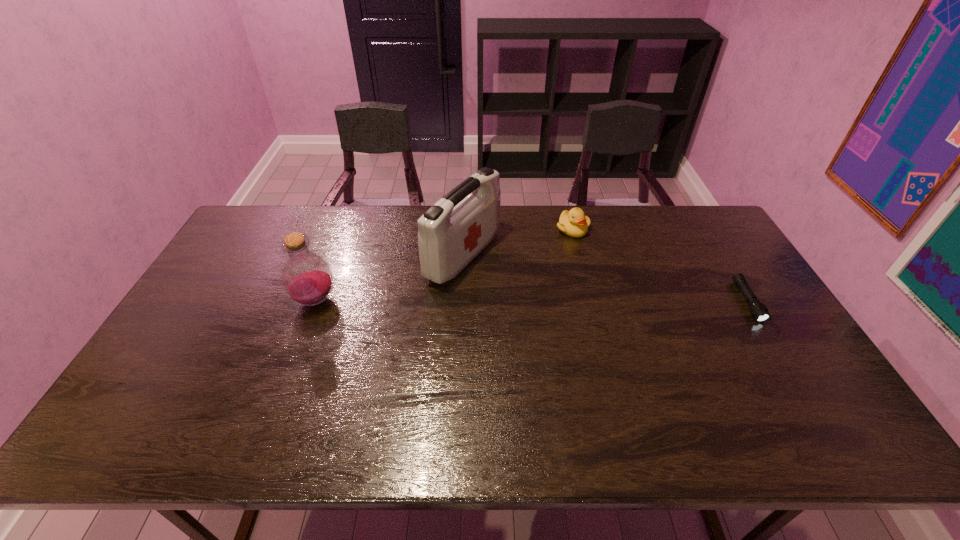
The height and width of the screenshot is (540, 960). In order to click on vacant spot on the desktop that is between the leftmost object and the rightmost object and is positioned on the front side of the third object from right to left in this screenshot , I will do `click(568, 301)`.

The height and width of the screenshot is (540, 960). Find the location of `free space on the desktop that is between the leftmost object and the shortest object and is positioned on the beak of the third tallest object`. free space on the desktop that is between the leftmost object and the shortest object and is positioned on the beak of the third tallest object is located at coordinates (574, 301).